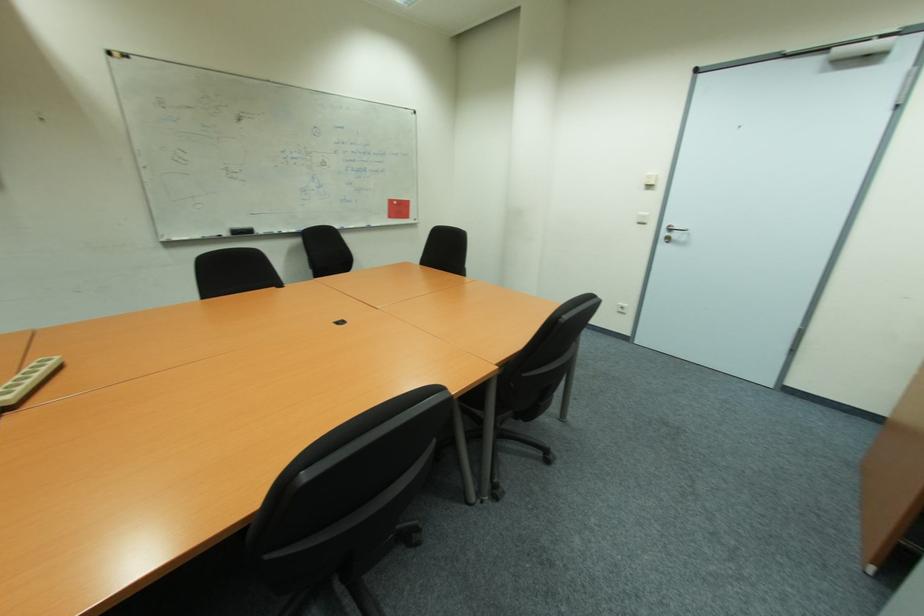
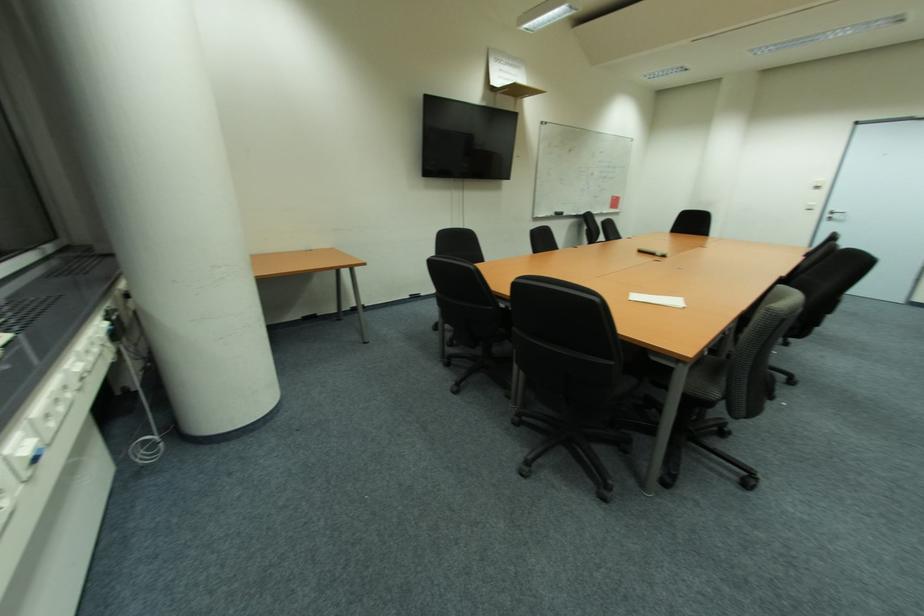
In the second image, find the point that corresponds to (x=647, y=187) in the first image.

(820, 188)